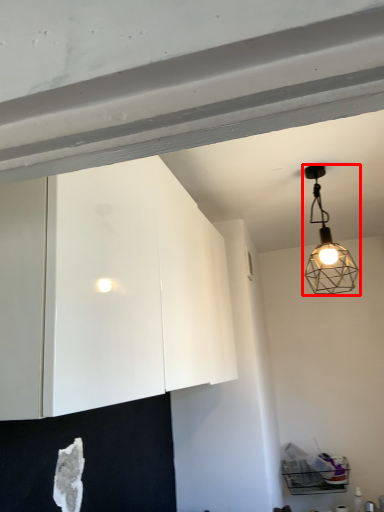
Question: From the image's perspective, what is the correct spatial relationship of lamp (annotated by the red box) in relation to cabinetry?

Choices:
 (A) below
 (B) above

Answer: (B)